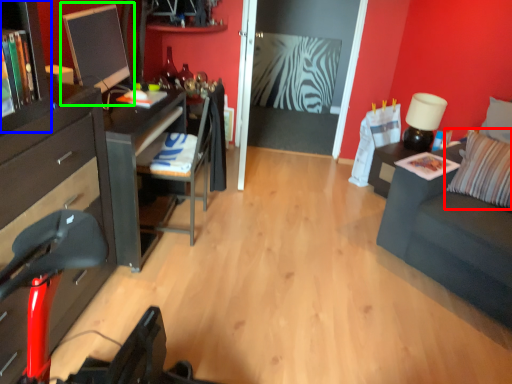
Question: Which object is the closest to the pillow (highlighted by a red box)? Choose among these: tv cabinet (highlighted by a blue box) or computer monitor (highlighted by a green box).

Choices:
 (A) tv cabinet
 (B) computer monitor

Answer: (B)